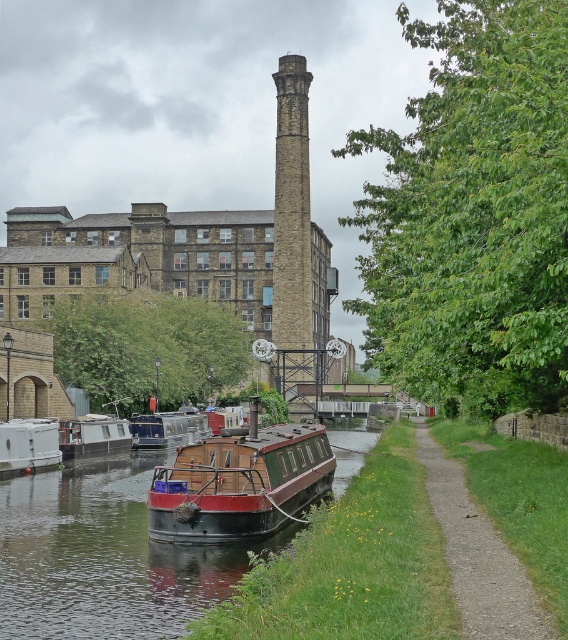
In the scene shown: You are standing on the gravel path at lower right and want to take a photo of the stone brick tower at center. In which direction should you turn to face the tower?

You should turn to your left to face the stone brick tower at center because it is located to the left of the gravel path at lower right.

You are a delivery person carrying a package that requires a flat surface to place temporarily. You see the gravel path at lower right and the white matte boat at lower left. Which surface would be more suitable for placing the package?

The white matte boat at lower left is taller than the gravel path at lower right, so the white matte boat at lower left provides a flatter surface for placing the package.

You are standing at the center of the image and want to walk to the gravel path at lower right. What direction should you move in?

You should move to the lower right direction to reach the gravel path at lower right.